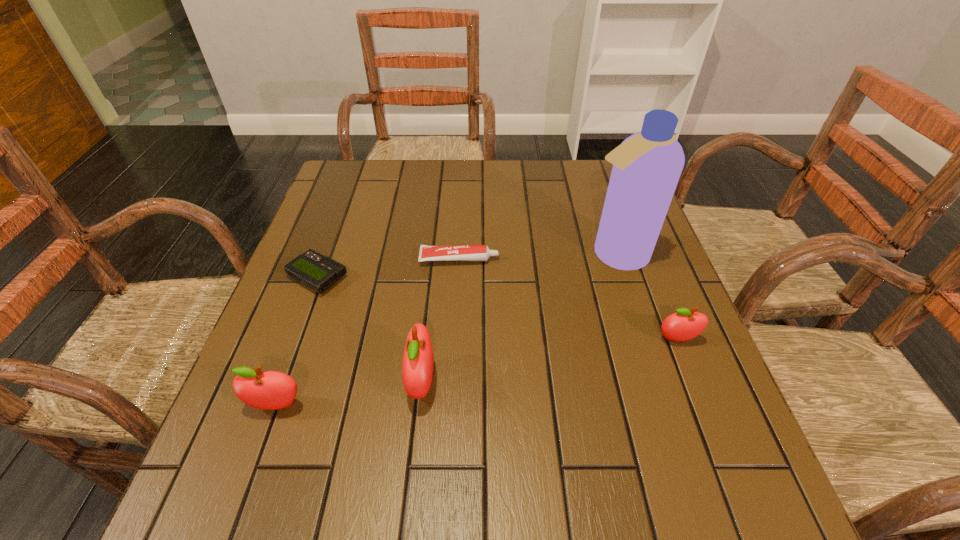
In order to click on the leftmost apple in this screenshot , I will do `click(270, 390)`.

Identify the location of the third tallest object. (270, 390).

Locate an element on the screen. the tallest apple is located at coordinates (417, 367).

Find the location of a particular element. the second apple from left to right is located at coordinates (417, 367).

Identify the location of the farthest apple. The image size is (960, 540). (684, 325).

In order to click on the fourth tallest object in this screenshot , I will do `click(684, 325)`.

Identify the location of toothpaste. (455, 252).

Image resolution: width=960 pixels, height=540 pixels. What are the coordinates of `beeper` in the screenshot? It's located at (318, 272).

At what (x,y) coordinates should I click in order to perform the action: click on shampoo. Please return your answer as a coordinate pair (x, y). This screenshot has height=540, width=960. Looking at the image, I should click on (647, 165).

At what (x,y) coordinates should I click in order to perform the action: click on vacant space located 0.060m on the right of the leftmost apple. Please return your answer as a coordinate pair (x, y). Looking at the image, I should click on (339, 406).